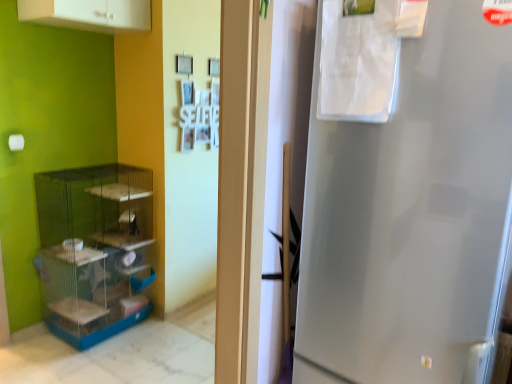
Question: Should I look upward or downward to see white matte cabinet at upper left?

Choices:
 (A) up
 (B) down

Answer: (A)

Question: Does blue plastic shelf at left have a greater height compared to white matte cabinet at upper left?

Choices:
 (A) yes
 (B) no

Answer: (A)

Question: Is blue plastic shelf at left smaller than white matte cabinet at upper left?

Choices:
 (A) yes
 (B) no

Answer: (B)

Question: From the image's perspective, does blue plastic shelf at left appear higher than white matte cabinet at upper left?

Choices:
 (A) yes
 (B) no

Answer: (B)

Question: Can you confirm if blue plastic shelf at left is positioned to the right of white matte cabinet at upper left?

Choices:
 (A) no
 (B) yes

Answer: (A)

Question: From a real-world perspective, is blue plastic shelf at left positioned over white matte cabinet at upper left based on gravity?

Choices:
 (A) no
 (B) yes

Answer: (A)

Question: Is blue plastic shelf at left in contact with white matte cabinet at upper left?

Choices:
 (A) yes
 (B) no

Answer: (B)

Question: Does white matte cabinet at upper left have a lesser width compared to blue plastic shelf at left?

Choices:
 (A) yes
 (B) no

Answer: (A)

Question: Is white matte cabinet at upper left aimed at blue plastic shelf at left?

Choices:
 (A) no
 (B) yes

Answer: (A)

Question: Is white matte cabinet at upper left positioned far away from blue plastic shelf at left?

Choices:
 (A) yes
 (B) no

Answer: (A)

Question: Does white matte cabinet at upper left contain blue plastic shelf at left?

Choices:
 (A) no
 (B) yes

Answer: (A)

Question: Is white matte cabinet at upper left positioned with its back to blue plastic shelf at left?

Choices:
 (A) no
 (B) yes

Answer: (A)

Question: Does white matte cabinet at upper left have a smaller size compared to blue plastic shelf at left?

Choices:
 (A) yes
 (B) no

Answer: (A)

Question: Looking at the image, does blue plastic shelf at left seem bigger or smaller compared to white matte cabinet at upper left?

Choices:
 (A) small
 (B) big

Answer: (B)